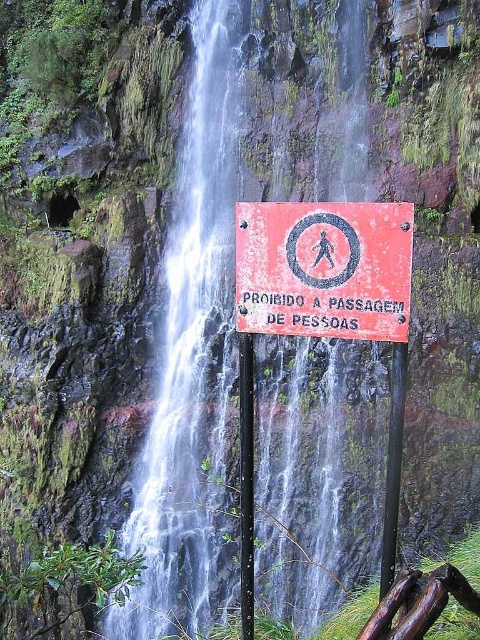
You are a hiker who wants to cross the smooth rock waterfall at center. You see the black metal pole at center nearby. Can you safely walk between them?

The smooth rock waterfall at center and black metal pole at center are 10.16 feet apart from each other. Since 10.16 feet is approximately 3.09 meters, there is enough space for a hiker to walk between them safely.